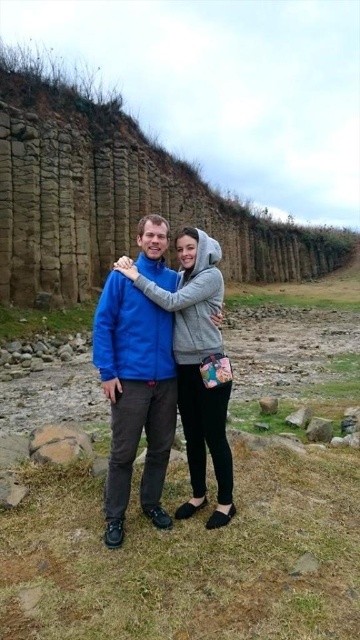
You are standing at the base of the columnar basalt rock formation and want to take a photo of the two friends. You notice two points marked on the rocks at coordinates point (154, 316) and point (329, 432). Which point should you focus on first if you want to ensure both friends are in the frame?

You should focus on point (154, 316) first because it is in front of point (329, 432), so capturing it first will help ensure both points are visible in the frame.

In the scene shown: You are planning to take a photo of the blue fleece jacket at center and the gray rough stone at lower right. Which object should you focus on first if you want to capture both in the same frame without moving the camera?

The blue fleece jacket at center is much taller than the gray rough stone at lower right, so you should focus on the blue fleece jacket at center first to ensure it fits within the frame.